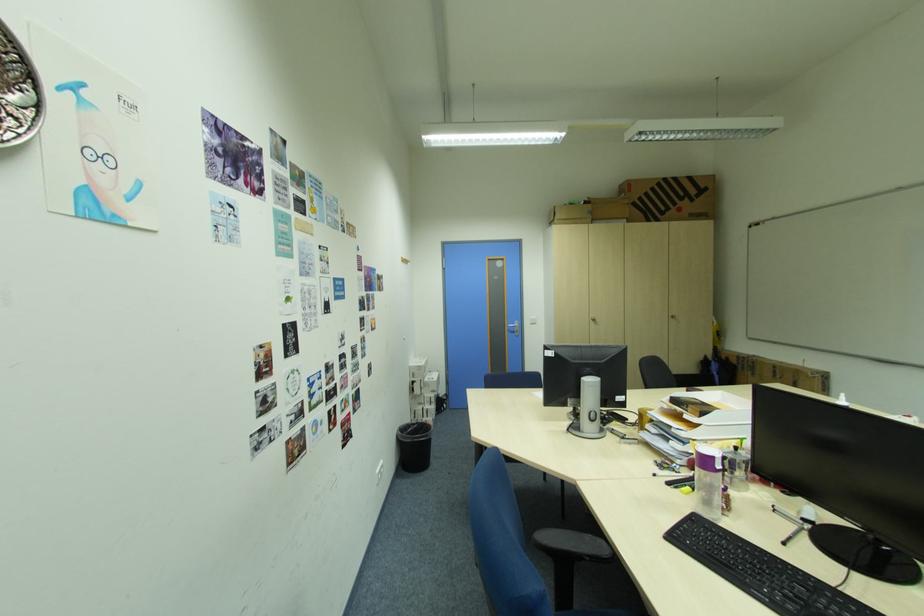
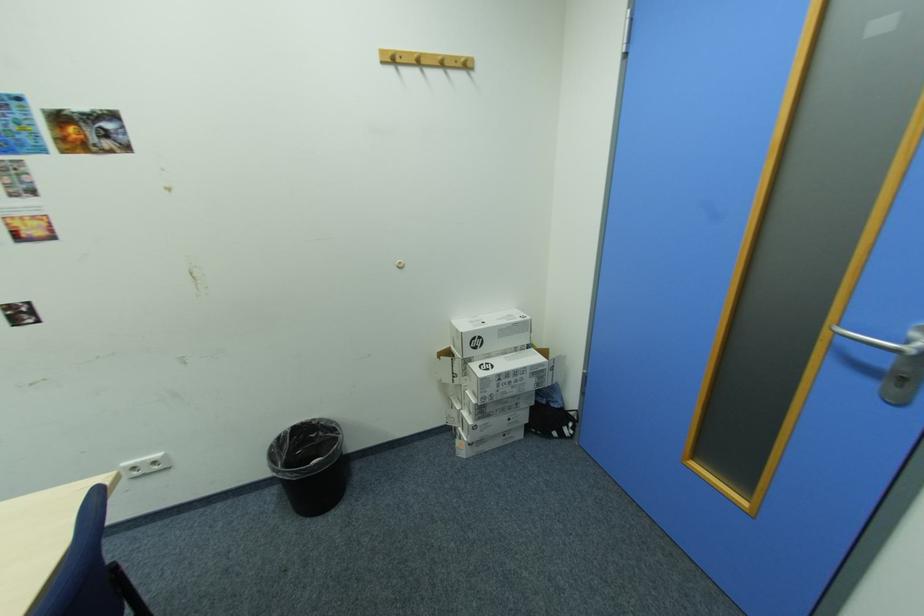
In the second image, find the point that corresponds to the point at 441,395 in the first image.

(481, 400)